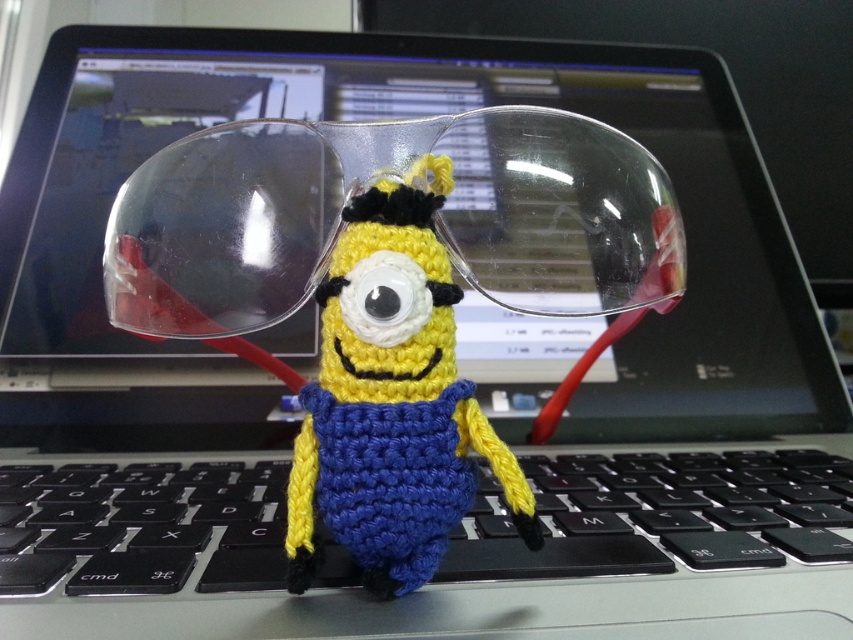
Question: Does transparent plastic glasses at center appear on the left side of black plastic keyboard at center?

Choices:
 (A) no
 (B) yes

Answer: (B)

Question: Among these points, which one is nearest to the camera?

Choices:
 (A) (445, 339)
 (B) (757, 490)

Answer: (A)

Question: Which point is closer to the camera?

Choices:
 (A) black plastic keyboard at center
 (B) transparent plastic glasses at center

Answer: (B)

Question: Is transparent plastic glasses at center positioned in front of black plastic keyboard at center?

Choices:
 (A) no
 (B) yes

Answer: (B)

Question: Which object is positioned farthest from the yellow yarn minion at center?

Choices:
 (A) black plastic keyboard at center
 (B) transparent plastic glasses at center

Answer: (A)

Question: Does black plastic keyboard at center come behind yellow yarn minion at center?

Choices:
 (A) yes
 (B) no

Answer: (A)